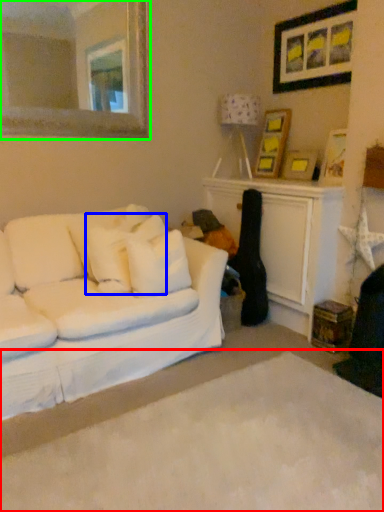
Question: Considering the real-world distances, which object is closest to plain (highlighted by a red box)? pillow (highlighted by a blue box) or mirror (highlighted by a green box).

Choices:
 (A) pillow
 (B) mirror

Answer: (A)